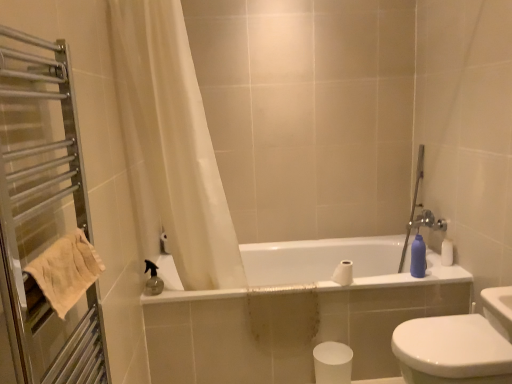
Question: From a real-world perspective, is matte plastic bottle at right located beneath white glossy bathtub at center?

Choices:
 (A) no
 (B) yes

Answer: (A)

Question: Is matte plastic bottle at right taller than white glossy bathtub at center?

Choices:
 (A) yes
 (B) no

Answer: (B)

Question: From the image's perspective, is matte plastic bottle at right located above white glossy bathtub at center?

Choices:
 (A) no
 (B) yes

Answer: (B)

Question: Does matte plastic bottle at right have a larger size compared to white glossy bathtub at center?

Choices:
 (A) no
 (B) yes

Answer: (A)

Question: Is white glossy bathtub at center at the back of matte plastic bottle at right?

Choices:
 (A) yes
 (B) no

Answer: (B)

Question: Is matte plastic bottle at right outside white glossy bathtub at center?

Choices:
 (A) yes
 (B) no

Answer: (A)

Question: Does beige cotton towel at left come in front of white sheer curtain at upper left?

Choices:
 (A) yes
 (B) no

Answer: (A)

Question: Does beige cotton towel at left appear on the right side of white sheer curtain at upper left?

Choices:
 (A) no
 (B) yes

Answer: (A)

Question: From the image's perspective, does beige cotton towel at left appear higher than white sheer curtain at upper left?

Choices:
 (A) no
 (B) yes

Answer: (A)

Question: Would you consider beige cotton towel at left to be distant from white sheer curtain at upper left?

Choices:
 (A) no
 (B) yes

Answer: (A)

Question: Does beige cotton towel at left appear on the left side of white sheer curtain at upper left?

Choices:
 (A) no
 (B) yes

Answer: (B)

Question: Would you say white sheer curtain at upper left is part of beige cotton towel at left's contents?

Choices:
 (A) no
 (B) yes

Answer: (A)

Question: Is white glossy bidet at lower right surrounding white matte toilet paper at center, marked as the second toilet paper in a bottom-to-top arrangement?

Choices:
 (A) no
 (B) yes

Answer: (A)